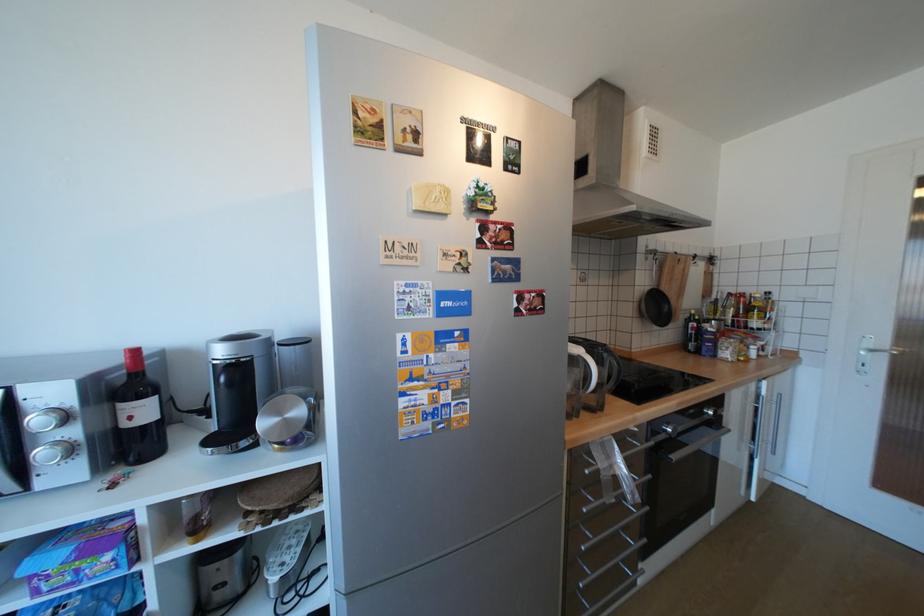
You are a GUI agent. You are given a task and a screenshot of the screen. Output one action in this format:
    pyautogui.click(x=<x>, y=<y>)
    Task: Click on the capsule holder lid
    
    Given the screenshot: What is the action you would take?
    pyautogui.click(x=287, y=419)